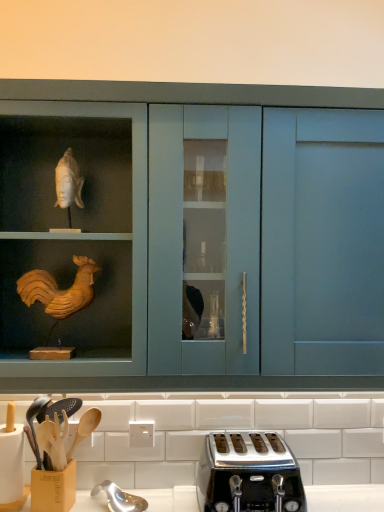
Question: Based on their positions, is wooden utensil holder at lower left located to the left or right of polished chrome toaster at lower center?

Choices:
 (A) left
 (B) right

Answer: (A)

Question: Considering the positions of wooden utensil holder at lower left and polished chrome toaster at lower center in the image, is wooden utensil holder at lower left bigger or smaller than polished chrome toaster at lower center?

Choices:
 (A) small
 (B) big

Answer: (A)

Question: Estimate the real-world distances between objects in this image. Which object is farther from the polished chrome toaster at lower center?

Choices:
 (A) wooden utensil holder at lower left
 (B) matte blue cabinet at center

Answer: (A)

Question: Which object is the closest to the wooden utensil holder at lower left?

Choices:
 (A) polished chrome toaster at lower center
 (B) matte blue cabinet at center

Answer: (A)